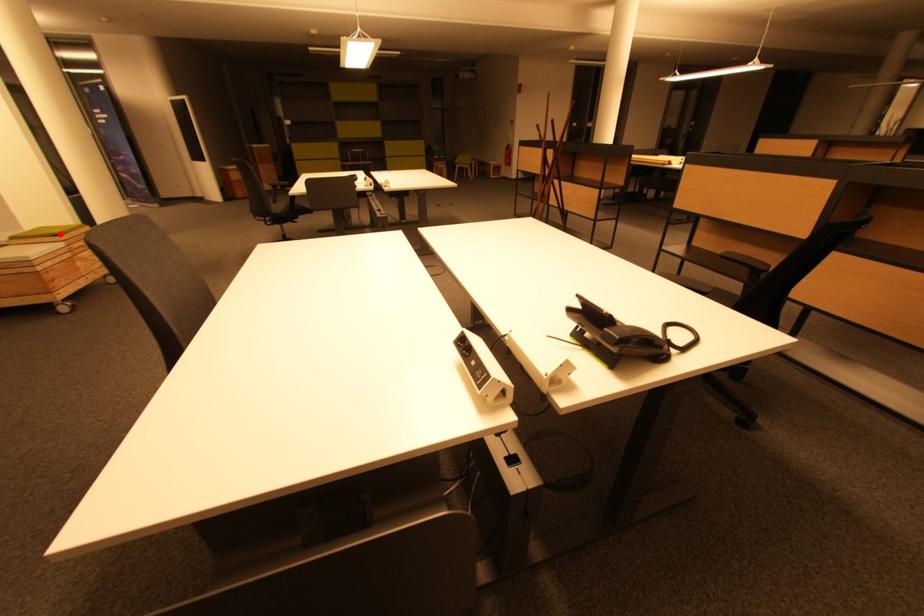
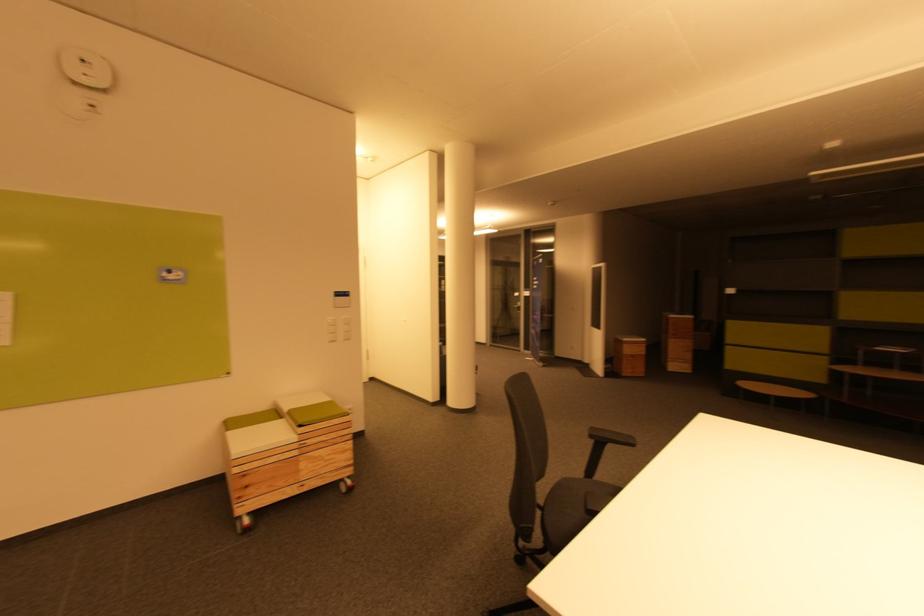
In the second image, find the point that corresponds to the highlighted location in the first image.

(305, 424)